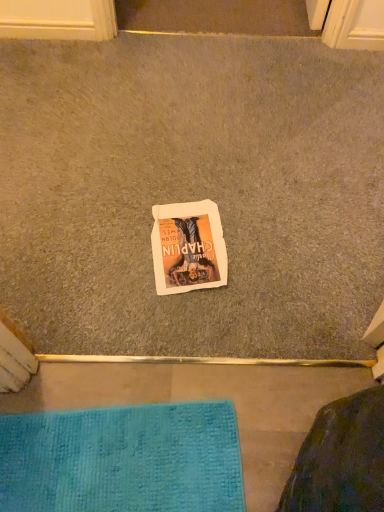
Locate an element on the screen. This screenshot has height=512, width=384. free point above gray carpet at center (from a real-world perspective) is located at coordinates (193, 154).